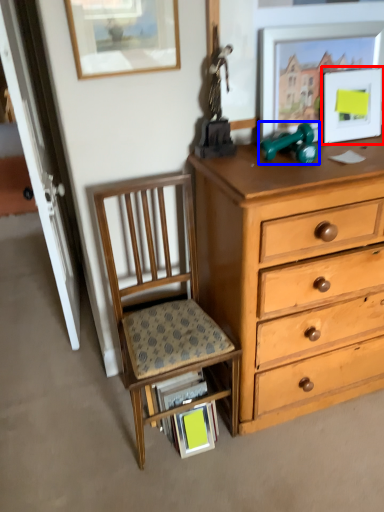
Question: Which point is further to the camera, picture frame (highlighted by a red box) or toy (highlighted by a blue box)?

Choices:
 (A) picture frame
 (B) toy

Answer: (A)